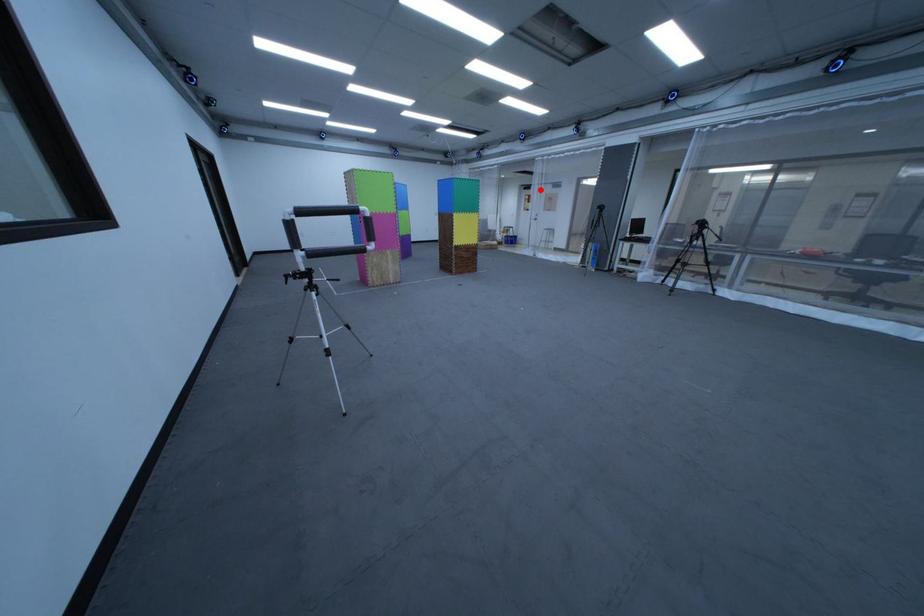
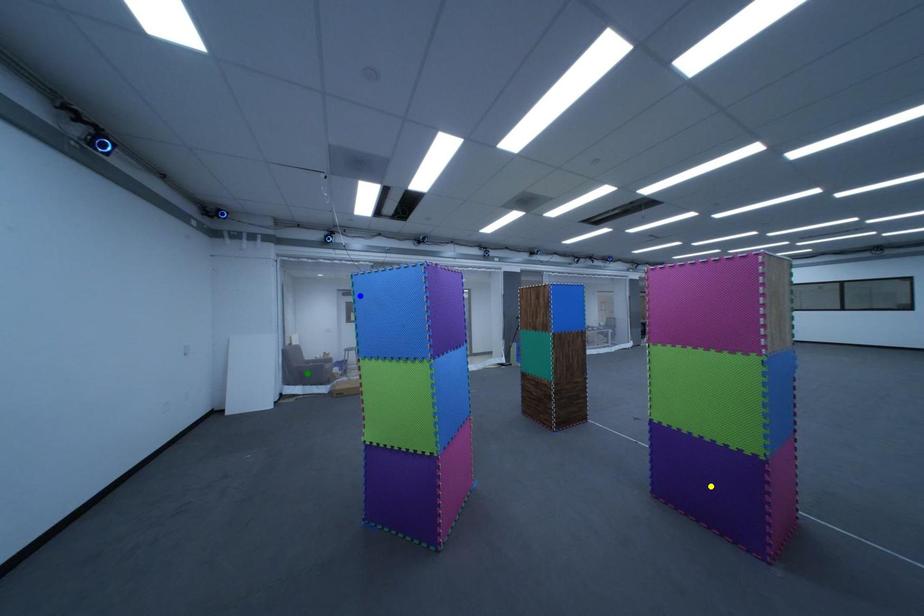
Question: I am providing you with two images of the same scene from different viewpoints. A red point is marked on the first image. You are given multiple points on the second image. Which spot in image 2 lines up with the point in image 1?

Choices:
 (A) yellow point
 (B) green point
 (C) blue point

Answer: (C)